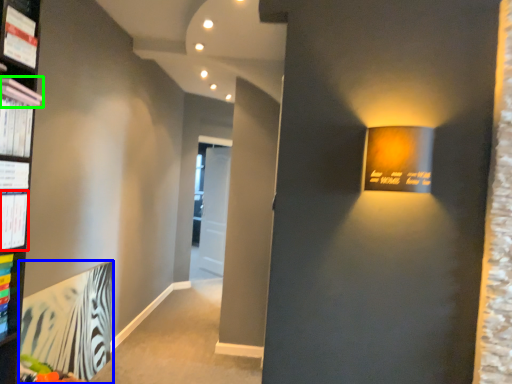
Question: Based on their relative distances, which object is farther from paperback book (highlighted by a red box)? Choose from paperback book (highlighted by a blue box) and book (highlighted by a green box).

Choices:
 (A) paperback book
 (B) book

Answer: (A)